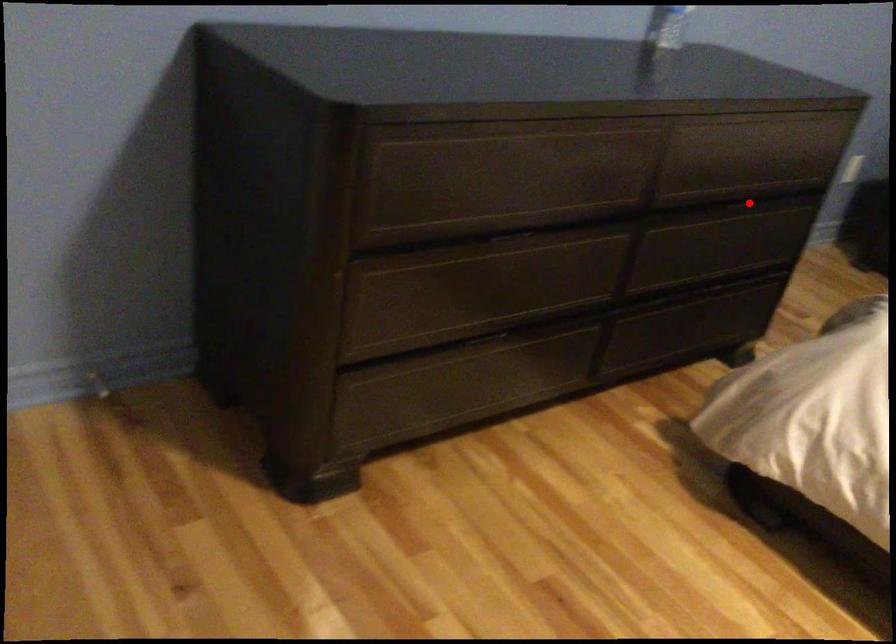
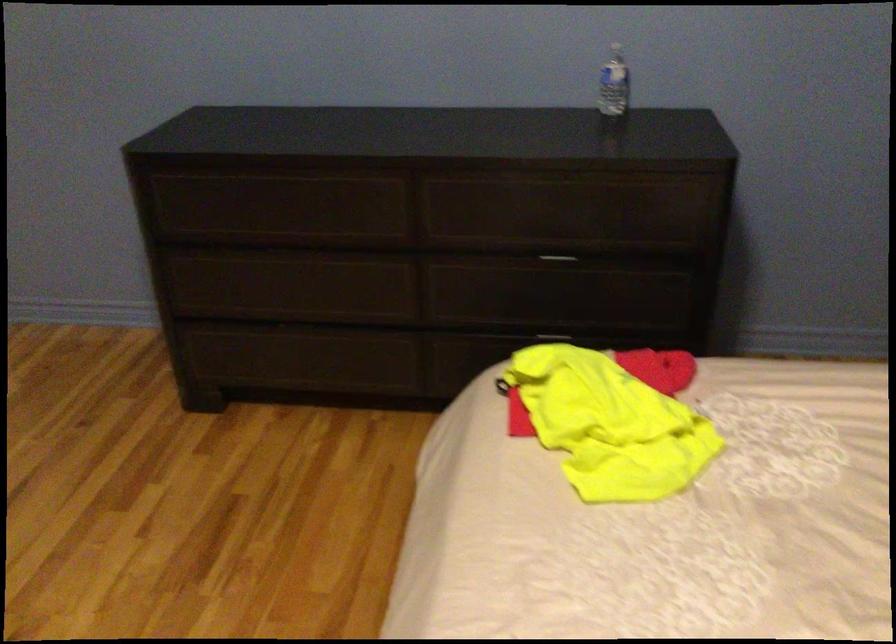
The point at the highlighted location is marked in the first image. Where is the corresponding point in the second image?

(557, 260)